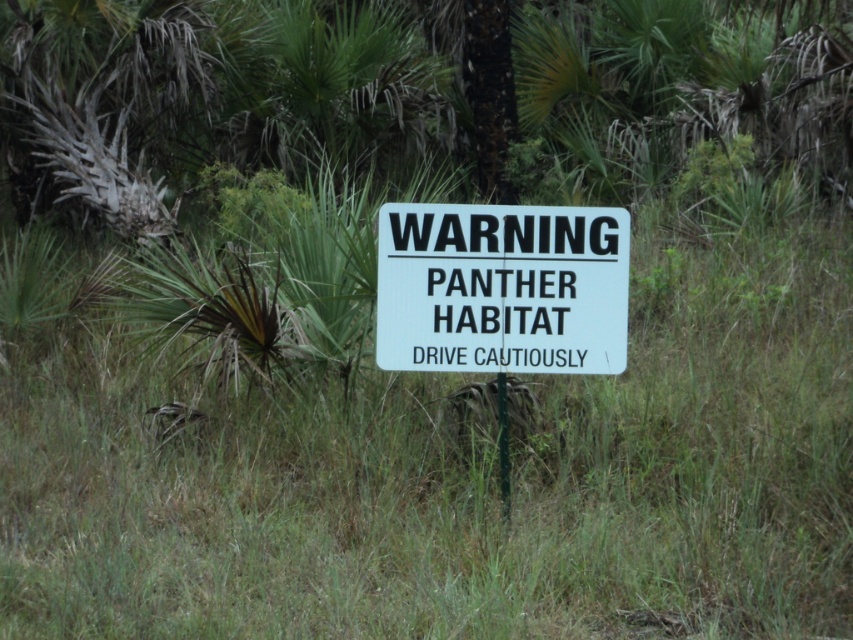
Is green leafy tree at center closer to camera compared to white plastic sign at center?

No, it is behind white plastic sign at center.

Which is below, green leafy tree at center or white plastic sign at center?

Positioned lower is white plastic sign at center.

Between point (137, 36) and point (395, 328), which one is positioned in front?

Point (395, 328) is in front.

This screenshot has height=640, width=853. I want to click on green leafy tree at center, so click(427, 88).